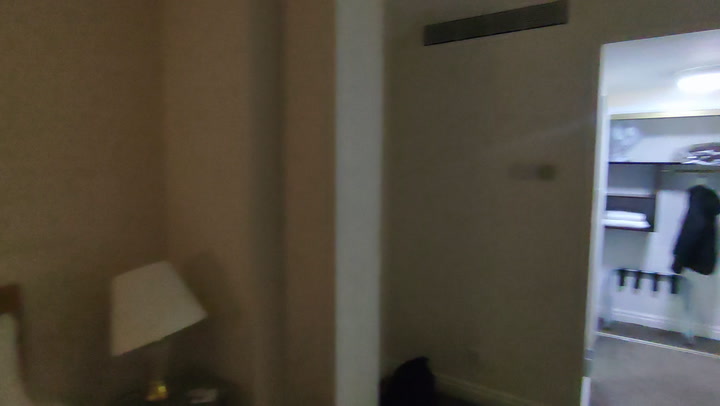
The height and width of the screenshot is (406, 720). In order to click on closet in this screenshot , I will do `click(651, 81)`.